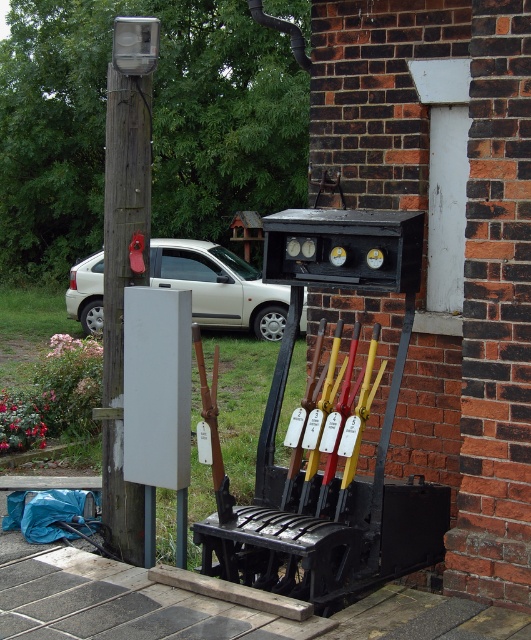
You are a railway engineer standing in front of the signal box. You see the wooden pole at left and the white matte car at left. Which object is more to the left?

The white matte car at left is more to the left because the wooden pole at left is positioned on the right side of it.

You are a railway worker standing next to the wooden pole at left and the white matte car at left. You need to access the lever handles in front of the signal box. Which object is blocking your path to the lever handles?

The white matte car at left is blocking the path because the wooden pole at left is positioned under it, meaning the car is above the pole and likely in the way of reaching the lever handles.